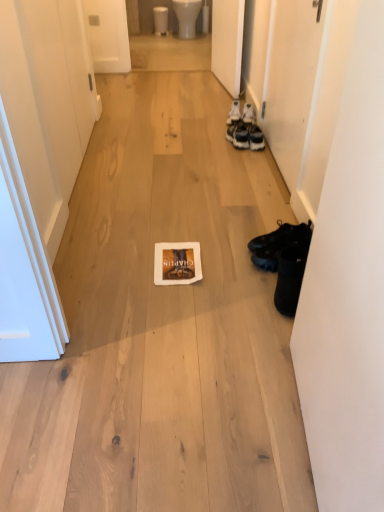
Where is `black leather shoes at right, the 2th footwear from the back`? The image size is (384, 512). black leather shoes at right, the 2th footwear from the back is located at coordinates (277, 234).

Describe the element at coordinates (160, 20) in the screenshot. I see `white glossy toilet bowl at upper center, the second toilet bowl in the right-to-left sequence` at that location.

In order to click on white glossy toilet bowl at upper center, placed as the first toilet bowl when sorted from left to right in this screenshot , I will do `click(160, 20)`.

Measure the distance between white leather sneakers at right, which is the third footwear from bottom to top, and camera.

The distance of white leather sneakers at right, which is the third footwear from bottom to top, from camera is 2.88 meters.

Where is `white matte door at upper left, which appears as the 3th door when viewed from the right`? Image resolution: width=384 pixels, height=512 pixels. white matte door at upper left, which appears as the 3th door when viewed from the right is located at coordinates (47, 102).

Measure the distance between white matte door at upper left, which appears as the 3th door when viewed from the right, and camera.

34.92 inches.

I want to click on white glossy toilet bowl at upper center, which is the first toilet bowl from right to left, so click(x=187, y=16).

Describe the element at coordinates (227, 42) in the screenshot. I see `white matte door at upper right, marked as the 2th door in a right-to-left arrangement` at that location.

This screenshot has width=384, height=512. Describe the element at coordinates (289, 278) in the screenshot. I see `black leather shoes at lower right, which is the first footwear from front to back` at that location.

This screenshot has height=512, width=384. I want to click on black leather shoes at right, which ranks as the 2th footwear in front-to-back order, so click(x=277, y=234).

How many degrees apart are the facing directions of black leather shoes at right, acting as the 2th footwear starting from the bottom, and black leather shoes at lower right, which is counted as the third footwear, starting from the top?

The angle between the facing direction of black leather shoes at right, acting as the 2th footwear starting from the bottom, and the facing direction of black leather shoes at lower right, which is counted as the third footwear, starting from the top, is 0.493 degrees.

Is black leather shoes at right, acting as the 2th footwear starting from the top, beside black leather shoes at lower right, which is the first footwear from front to back?

black leather shoes at right, acting as the 2th footwear starting from the top, and black leather shoes at lower right, which is the first footwear from front to back, are not in contact.

Consider the image. From a real-world perspective, is black leather shoes at right, acting as the 2th footwear starting from the top, positioned under black leather shoes at lower right, which is counted as the third footwear, starting from the top, based on gravity?

Yes, from a real-world perspective, black leather shoes at right, acting as the 2th footwear starting from the top, is beneath black leather shoes at lower right, which is counted as the third footwear, starting from the top.

Which is in front, point (291, 226) or point (284, 286)?

The point (284, 286) is closer.

Does white glossy toilet bowl at upper center, placed as the first toilet bowl when sorted from left to right, have a lesser width compared to white leather sneakers at right, which ranks as the 1th footwear in top-to-bottom order?

No, white glossy toilet bowl at upper center, placed as the first toilet bowl when sorted from left to right, is not thinner than white leather sneakers at right, which ranks as the 1th footwear in top-to-bottom order.

Considering the relative sizes of white glossy toilet bowl at upper center, the second toilet bowl in the right-to-left sequence, and white leather sneakers at right, which ranks as the 1th footwear in top-to-bottom order, in the image provided, is white glossy toilet bowl at upper center, the second toilet bowl in the right-to-left sequence, taller than white leather sneakers at right, which ranks as the 1th footwear in top-to-bottom order,?

Indeed, white glossy toilet bowl at upper center, the second toilet bowl in the right-to-left sequence, has a greater height compared to white leather sneakers at right, which ranks as the 1th footwear in top-to-bottom order.

Is white glossy toilet bowl at upper center, the second toilet bowl in the right-to-left sequence, looking in the opposite direction of white leather sneakers at right, the 1th footwear from the back?

No, white glossy toilet bowl at upper center, the second toilet bowl in the right-to-left sequence,'s orientation is not away from white leather sneakers at right, the 1th footwear from the back.

Is there a large distance between white leather sneakers at right, the 1th footwear from the back, and white matte door at upper left, the 1th door from the left?

Yes.

Looking at this image, considering the sizes of objects white leather sneakers at right, the third footwear in the front-to-back sequence, and white matte door at upper left, which appears as the 3th door when viewed from the right, in the image provided, who is taller, white leather sneakers at right, the third footwear in the front-to-back sequence, or white matte door at upper left, which appears as the 3th door when viewed from the right,?

With more height is white matte door at upper left, which appears as the 3th door when viewed from the right.

From a real-world perspective, relative to white matte door at upper left, the 1th door from the left, is white leather sneakers at right, which is the third footwear from bottom to top, vertically above or below?

white leather sneakers at right, which is the third footwear from bottom to top, is situated lower than white matte door at upper left, the 1th door from the left, in the real world.

Considering the relative sizes of white matte door at upper right, marked as the 2th door in a right-to-left arrangement, and white matte door at upper left, the 1th door from the left, in the image provided, is white matte door at upper right, marked as the 2th door in a right-to-left arrangement, thinner than white matte door at upper left, the 1th door from the left,?

No.

Find the location of `door lying above the white matte door at upper left, the 1th door from the left (from the image's perspective)`. door lying above the white matte door at upper left, the 1th door from the left (from the image's perspective) is located at coordinates (227, 42).

Does white matte door at upper right, marked as the 2th door in a left-to-right arrangement, have a larger size compared to white matte door at upper left, which appears as the 3th door when viewed from the right?

No.

Based on the photo, from a real-world perspective, between white matte door at upper right, marked as the 2th door in a left-to-right arrangement, and white glossy toilet bowl at upper center, placed as the first toilet bowl when sorted from left to right, who is vertically higher?

white matte door at upper right, marked as the 2th door in a left-to-right arrangement.

Is white matte door at upper right, marked as the 2th door in a left-to-right arrangement, looking in the opposite direction of white glossy toilet bowl at upper center, placed as the first toilet bowl when sorted from left to right?

No, white matte door at upper right, marked as the 2th door in a left-to-right arrangement, is not facing away from white glossy toilet bowl at upper center, placed as the first toilet bowl when sorted from left to right.

Is white matte door at upper right, marked as the 2th door in a left-to-right arrangement, further to the viewer compared to white glossy toilet bowl at upper center, placed as the first toilet bowl when sorted from left to right?

No, white matte door at upper right, marked as the 2th door in a left-to-right arrangement, is closer to the camera.

Is white matte door at upper right, marked as the 2th door in a left-to-right arrangement, to the right of white glossy toilet bowl at upper center, placed as the first toilet bowl when sorted from left to right, from the viewer's perspective?

Correct, you'll find white matte door at upper right, marked as the 2th door in a left-to-right arrangement, to the right of white glossy toilet bowl at upper center, placed as the first toilet bowl when sorted from left to right.

Which is in front, point (173, 4) or point (300, 260)?

The point (300, 260) is closer.

Looking at this image, from the image's perspective, who appears lower, white glossy toilet bowl at upper center, which is the 2th toilet bowl from left to right, or black leather shoes at lower right, placed as the third footwear when sorted from back to front?

black leather shoes at lower right, placed as the third footwear when sorted from back to front, is shown below in the image.

Is white glossy toilet bowl at upper center, which is the 2th toilet bowl from left to right, positioned far away from black leather shoes at lower right, arranged as the 1th footwear when ordered from the bottom?

Indeed, white glossy toilet bowl at upper center, which is the 2th toilet bowl from left to right, is not near black leather shoes at lower right, arranged as the 1th footwear when ordered from the bottom.

Is white glossy toilet bowl at upper center, which is the first toilet bowl from right to left, in front of or behind black leather shoes at lower right, which is the first footwear from front to back, in the image?

white glossy toilet bowl at upper center, which is the first toilet bowl from right to left, is behind black leather shoes at lower right, which is the first footwear from front to back.

Is black leather shoes at right, the 2th footwear from the back, positioned with its back to white leather sneakers at right, which ranks as the 1th footwear in top-to-bottom order?

No.

Measure the distance between black leather shoes at right, the 2th footwear from the back, and white leather sneakers at right, which is the third footwear from bottom to top.

They are 1.32 meters apart.

Considering the relative sizes of black leather shoes at right, acting as the 2th footwear starting from the bottom, and white leather sneakers at right, which ranks as the 1th footwear in top-to-bottom order, in the image provided, is black leather shoes at right, acting as the 2th footwear starting from the bottom, smaller than white leather sneakers at right, which ranks as the 1th footwear in top-to-bottom order,?

Incorrect, black leather shoes at right, acting as the 2th footwear starting from the bottom, is not smaller in size than white leather sneakers at right, which ranks as the 1th footwear in top-to-bottom order.

How many degrees apart are the facing directions of black leather shoes at right, the 2th footwear from the back, and white leather sneakers at right, the 1th footwear from the back?

The angular difference between black leather shoes at right, the 2th footwear from the back, and white leather sneakers at right, the 1th footwear from the back, is 97.4 degrees.

Locate an element on the screen. This screenshot has height=512, width=384. footwear on the right side of black leather shoes at lower right, placed as the third footwear when sorted from back to front is located at coordinates (277, 234).

I want to click on the 1st footwear positioned below the white glossy toilet bowl at upper center, placed as the first toilet bowl when sorted from left to right (from the image's perspective), so click(x=234, y=112).

Looking at the image, which one is located further to black leather shoes at lower right, which is counted as the third footwear, starting from the top, white matte door at right, acting as the third door starting from the left, or white matte door at upper left, which appears as the 3th door when viewed from the right?

Among the two, white matte door at upper left, which appears as the 3th door when viewed from the right, is located further to black leather shoes at lower right, which is counted as the third footwear, starting from the top.

Based on their spatial positions, is black leather shoes at right, acting as the 2th footwear starting from the bottom, or white matte door at upper right, marked as the 2th door in a right-to-left arrangement, further from white leather sneakers at right, which is the third footwear from bottom to top?

Among the two, black leather shoes at right, acting as the 2th footwear starting from the bottom, is located further to white leather sneakers at right, which is the third footwear from bottom to top.

When comparing their distances from black leather shoes at right, acting as the 2th footwear starting from the top, does white matte door at right, acting as the third door starting from the left, or white matte door at upper left, the 1th door from the left, seem closer?

white matte door at right, acting as the third door starting from the left.

When comparing their distances from white matte door at upper left, which appears as the 3th door when viewed from the right, does black leather shoes at right, which ranks as the 2th footwear in front-to-back order, or white leather sneakers at right, the 1th footwear from the back, seem further?

white leather sneakers at right, the 1th footwear from the back.

From the image, which object appears to be farther from white glossy toilet bowl at upper center, which is the 2th toilet bowl from left to right, black leather shoes at right, the 2th footwear from the back, or white matte door at right, acting as the third door starting from the left?

Among the two, black leather shoes at right, the 2th footwear from the back, is located further to white glossy toilet bowl at upper center, which is the 2th toilet bowl from left to right.

Which object lies further to the anchor point white glossy toilet bowl at upper center, placed as the first toilet bowl when sorted from left to right, black leather shoes at right, which ranks as the 2th footwear in front-to-back order, or white leather sneakers at right, which is the third footwear from bottom to top?

black leather shoes at right, which ranks as the 2th footwear in front-to-back order, is further to white glossy toilet bowl at upper center, placed as the first toilet bowl when sorted from left to right.

Which object lies further to the anchor point black leather shoes at right, the 2th footwear from the back, white glossy toilet bowl at upper center, which is the 2th toilet bowl from left to right, or white leather sneakers at right, the third footwear in the front-to-back sequence?

white glossy toilet bowl at upper center, which is the 2th toilet bowl from left to right, is further to black leather shoes at right, the 2th footwear from the back.

Which object lies further to the anchor point white matte door at right, acting as the third door starting from the left, white glossy toilet bowl at upper center, the second toilet bowl in the right-to-left sequence, or black leather shoes at right, the 2th footwear from the back?

Among the two, white glossy toilet bowl at upper center, the second toilet bowl in the right-to-left sequence, is located further to white matte door at right, acting as the third door starting from the left.

The height and width of the screenshot is (512, 384). I want to click on footwear between white matte door at upper right, marked as the 2th door in a left-to-right arrangement, and black leather shoes at right, acting as the 2th footwear starting from the top, vertically, so click(234, 112).

Where is `door located between white matte door at upper left, which appears as the 3th door when viewed from the right, and white leather sneakers at right, the third footwear in the front-to-back sequence, in the depth direction`? door located between white matte door at upper left, which appears as the 3th door when viewed from the right, and white leather sneakers at right, the third footwear in the front-to-back sequence, in the depth direction is located at coordinates (290, 81).

Where is `footwear between white matte door at right, marked as the first door in a right-to-left arrangement, and black leather shoes at lower right, placed as the third footwear when sorted from back to front, from top to bottom`? The image size is (384, 512). footwear between white matte door at right, marked as the first door in a right-to-left arrangement, and black leather shoes at lower right, placed as the third footwear when sorted from back to front, from top to bottom is located at coordinates (277, 234).

Identify the location of toilet bowl positioned between white matte door at upper left, the 1th door from the left, and white glossy toilet bowl at upper center, the second toilet bowl in the right-to-left sequence, from near to far. Image resolution: width=384 pixels, height=512 pixels. (187, 16).